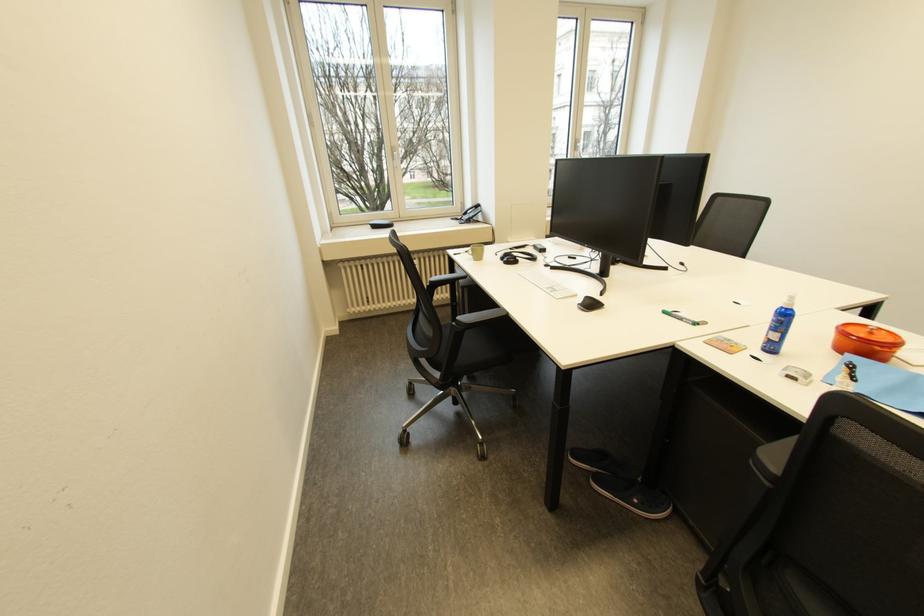
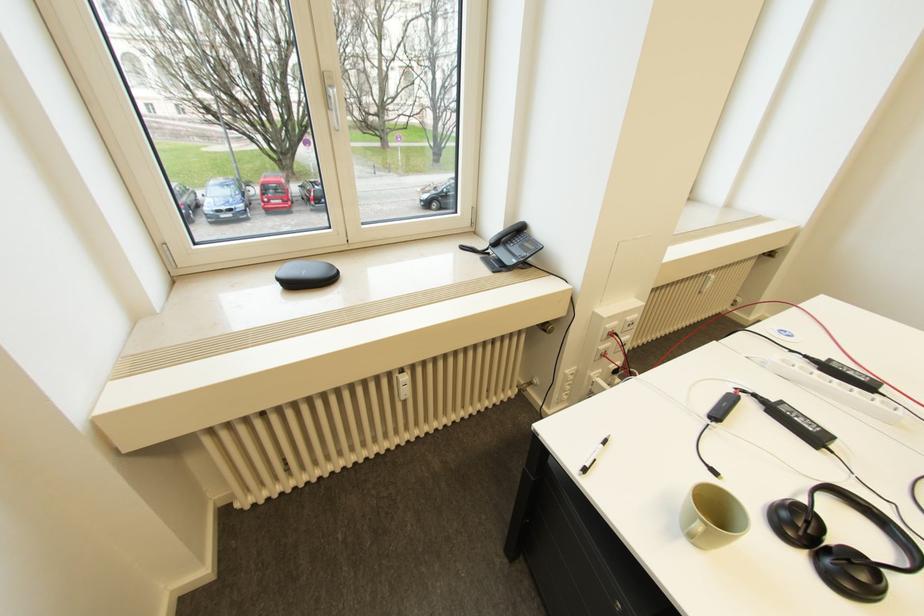
The point at (x=403, y=156) is marked in the first image. Where is the corresponding point in the second image?

(335, 98)